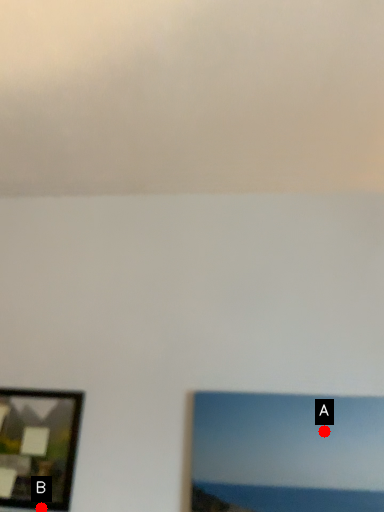
Question: Two points are circled on the image, labeled by A and B beside each circle. Which point is farther to the camera?

Choices:
 (A) A is further
 (B) B is further

Answer: (A)